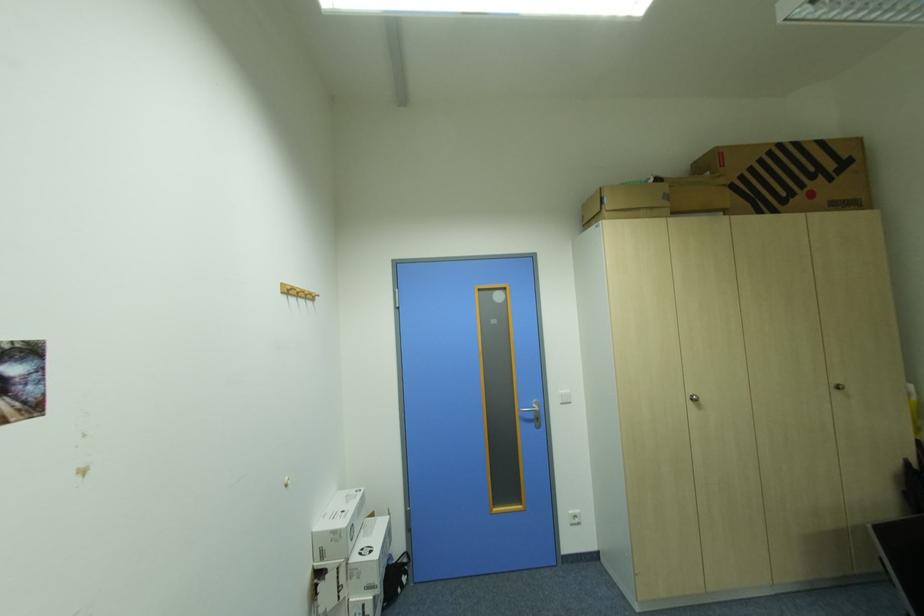
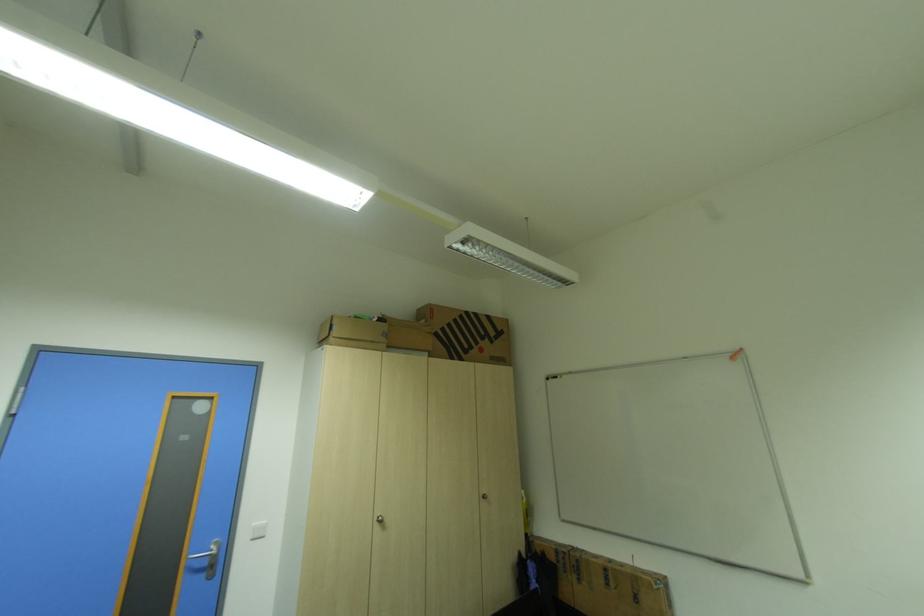
Consider the image. The first image is from the beginning of the video and the second image is from the end. How did the camera likely rotate when shooting the video?

The camera rotated toward right-up.